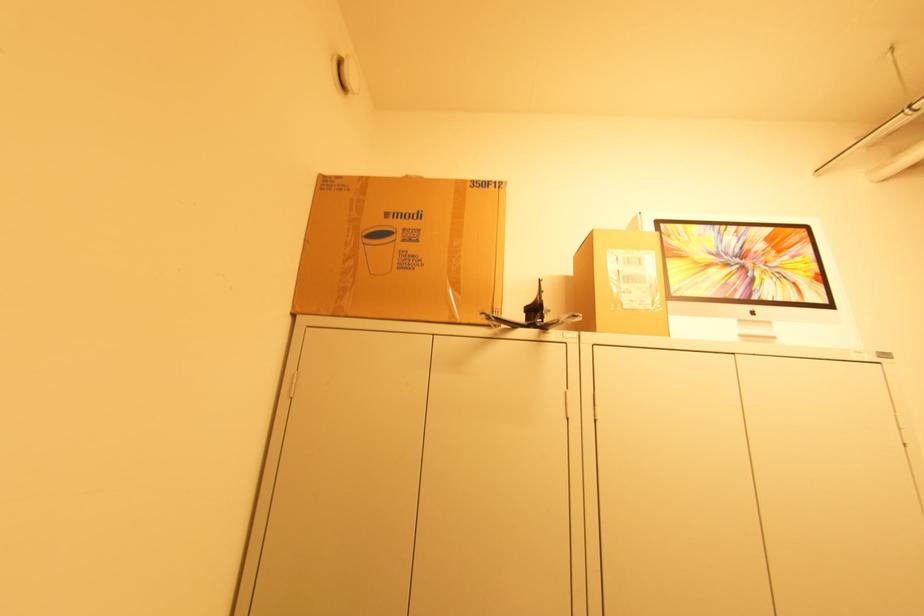
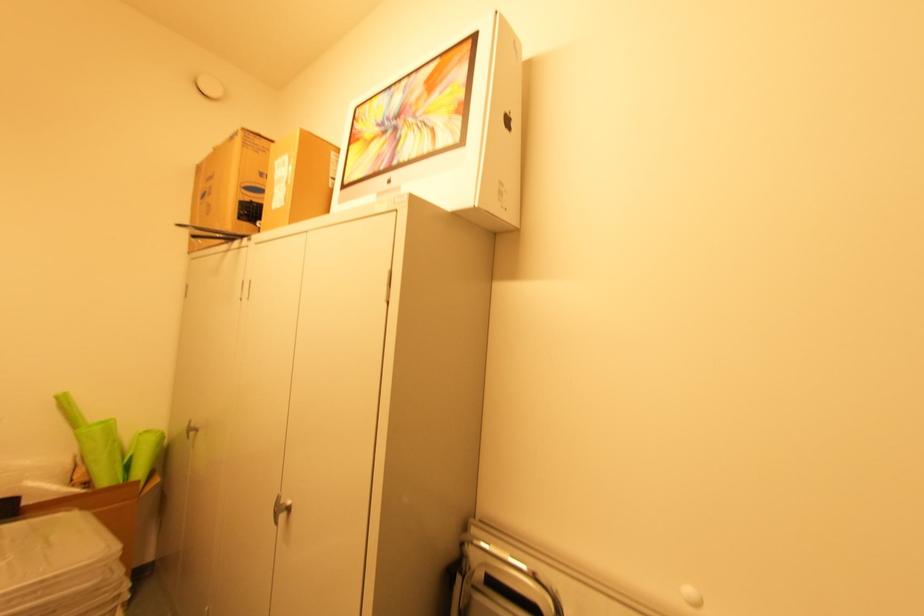
The point at (x=671, y=261) is marked in the first image. Where is the corresponding point in the second image?

(353, 148)